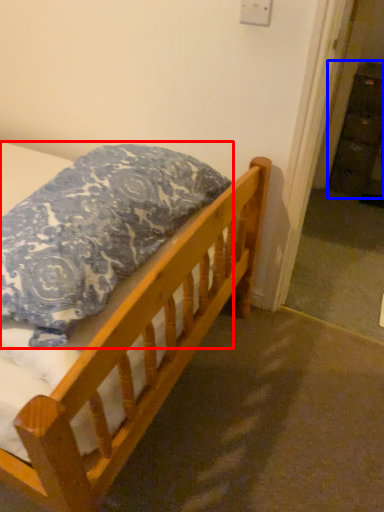
Question: Which object appears closest to the camera in this image, pillow (highlighted by a red box) or dresser (highlighted by a blue box)?

Choices:
 (A) pillow
 (B) dresser

Answer: (A)